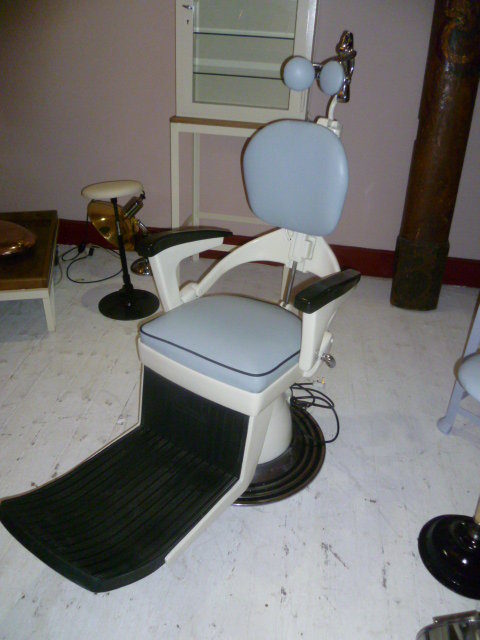
You are a GUI agent. You are given a task and a screenshot of the screen. Output one action in this format:
    pyautogui.click(x=<x>, y=<y>)
    Task: Click on the glass
    The height and width of the screenshot is (640, 480).
    Given the screenshot: What is the action you would take?
    pyautogui.click(x=232, y=13)